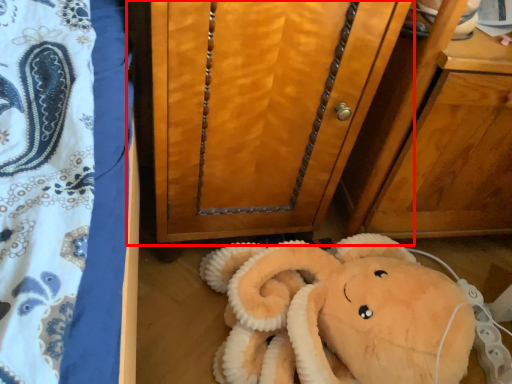
Question: From the image's perspective, considering the relative positions of furniture (annotated by the red box) and toy in the image provided, where is furniture (annotated by the red box) located with respect to the staircase?

Choices:
 (A) below
 (B) above

Answer: (B)